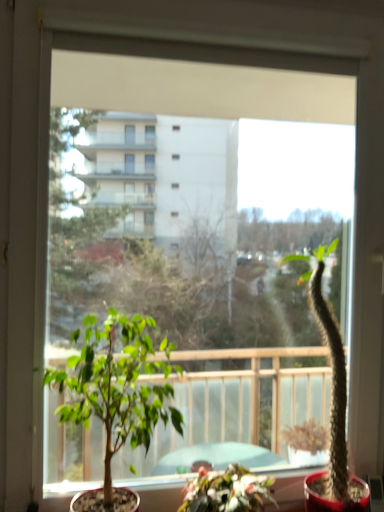
Question: Considering the relative positions of green succulent at right, the 3th houseplant positioned from the left, and green leafy plant at center, positioned as the 1th houseplant in left-to-right order, in the image provided, is green succulent at right, the 3th houseplant positioned from the left, in front of green leafy plant at center, positioned as the 1th houseplant in left-to-right order,?

Choices:
 (A) yes
 (B) no

Answer: (B)

Question: From a real-world perspective, is green succulent at right, the first houseplant when ordered from right to left, below green leafy plant at center, which appears as the 3th houseplant when viewed from the right?

Choices:
 (A) no
 (B) yes

Answer: (A)

Question: Is the surface of green succulent at right, the first houseplant when ordered from right to left, in direct contact with green leafy plant at center, positioned as the 1th houseplant in left-to-right order?

Choices:
 (A) yes
 (B) no

Answer: (B)

Question: From the image's perspective, is green succulent at right, the first houseplant when ordered from right to left, beneath green leafy plant at center, which appears as the 3th houseplant when viewed from the right?

Choices:
 (A) yes
 (B) no

Answer: (B)

Question: Considering the relative positions of green succulent at right, the 3th houseplant positioned from the left, and green leafy plant at center, positioned as the 1th houseplant in left-to-right order, in the image provided, is green succulent at right, the 3th houseplant positioned from the left, behind green leafy plant at center, positioned as the 1th houseplant in left-to-right order,?

Choices:
 (A) yes
 (B) no

Answer: (A)

Question: Is green leafy plant at center, which appears as the 3th houseplant when viewed from the right, inside the boundaries of green matte plant at center, the second houseplant in the right-to-left sequence, or outside?

Choices:
 (A) outside
 (B) inside

Answer: (A)

Question: Considering the positions of green leafy plant at center, which appears as the 3th houseplant when viewed from the right, and green matte plant at center, the second houseplant in the right-to-left sequence, in the image, is green leafy plant at center, which appears as the 3th houseplant when viewed from the right, bigger or smaller than green matte plant at center, the second houseplant in the right-to-left sequence,?

Choices:
 (A) big
 (B) small

Answer: (A)

Question: From their relative heights in the image, would you say green leafy plant at center, which appears as the 3th houseplant when viewed from the right, is taller or shorter than green matte plant at center, the second houseplant in the right-to-left sequence?

Choices:
 (A) short
 (B) tall

Answer: (B)

Question: Considering their positions, is green leafy plant at center, which appears as the 3th houseplant when viewed from the right, located in front of or behind green matte plant at center, the second houseplant in the right-to-left sequence?

Choices:
 (A) behind
 (B) front

Answer: (B)

Question: Is green succulent at right, the 3th houseplant positioned from the left, inside or outside of green matte plant at center, which appears as the second houseplant when viewed from the left?

Choices:
 (A) outside
 (B) inside

Answer: (A)

Question: Considering the positions of green succulent at right, the first houseplant when ordered from right to left, and green matte plant at center, which appears as the second houseplant when viewed from the left, in the image, is green succulent at right, the first houseplant when ordered from right to left, wider or thinner than green matte plant at center, which appears as the second houseplant when viewed from the left,?

Choices:
 (A) wide
 (B) thin

Answer: (B)

Question: Is point (309, 508) closer or farther from the camera than point (266, 487)?

Choices:
 (A) farther
 (B) closer

Answer: (A)

Question: From the image's perspective, is green succulent at right, the 3th houseplant positioned from the left, positioned above or below green matte plant at center, the second houseplant in the right-to-left sequence?

Choices:
 (A) above
 (B) below

Answer: (A)

Question: Considering their positions, is green matte plant at center, the second houseplant in the right-to-left sequence, located in front of or behind green succulent at right, the 3th houseplant positioned from the left?

Choices:
 (A) front
 (B) behind

Answer: (A)

Question: Is green matte plant at center, which appears as the second houseplant when viewed from the left, wider or thinner than green succulent at right, the 3th houseplant positioned from the left?

Choices:
 (A) wide
 (B) thin

Answer: (A)